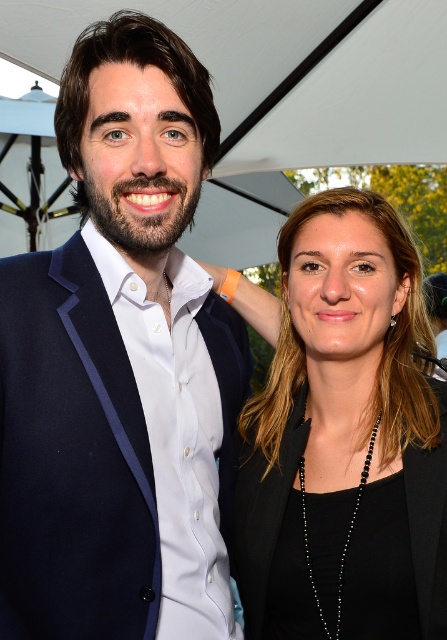
Question: Is matte blue suit at left smaller than black matte blazer at center?

Choices:
 (A) no
 (B) yes

Answer: (A)

Question: Among these points, which one is farthest from the camera?

Choices:
 (A) (95, 456)
 (B) (442, 570)

Answer: (B)

Question: Which of the following is the farthest from the observer?

Choices:
 (A) matte blue suit at left
 (B) black matte blazer at center

Answer: (B)

Question: Is matte blue suit at left positioned before black matte blazer at center?

Choices:
 (A) no
 (B) yes

Answer: (B)

Question: Does matte blue suit at left appear on the left side of black matte blazer at center?

Choices:
 (A) yes
 (B) no

Answer: (A)